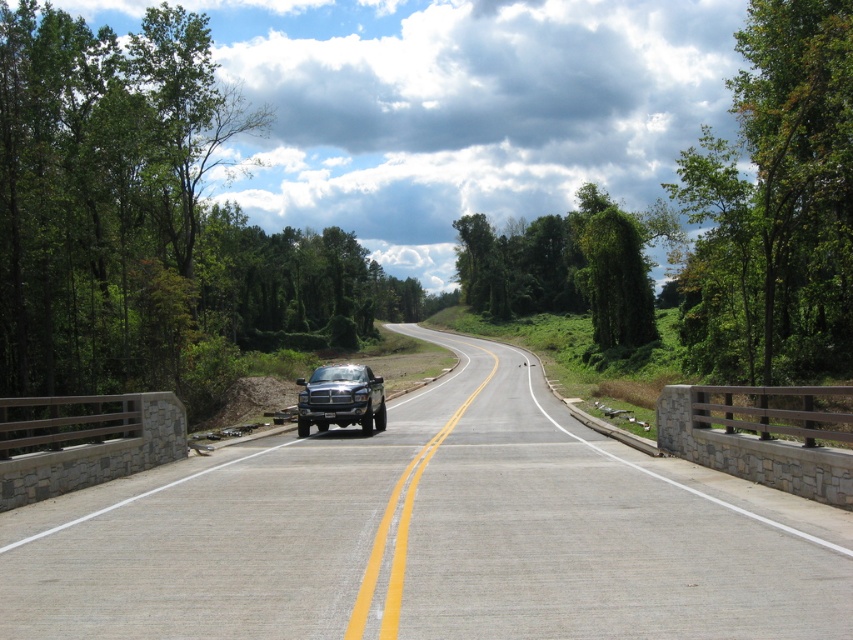
Looking at this image, is gray asphalt highway at center positioned in front of matte black truck at center?

That is True.

Identify the location of gray asphalt highway at center. Image resolution: width=853 pixels, height=640 pixels. pyautogui.click(x=431, y=534).

Locate an element on the screen. gray asphalt highway at center is located at coordinates (431, 534).